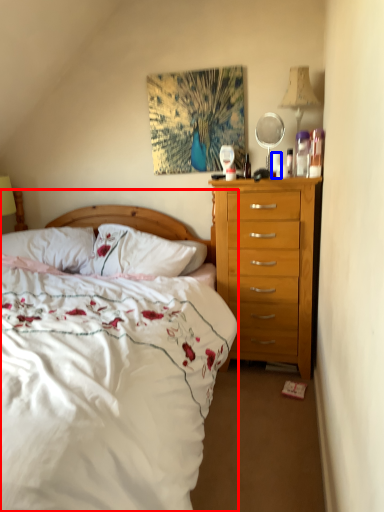
Question: Which of the following is the closest to the observer, bed (highlighted by a red box) or coffee cup (highlighted by a blue box)?

Choices:
 (A) bed
 (B) coffee cup

Answer: (A)